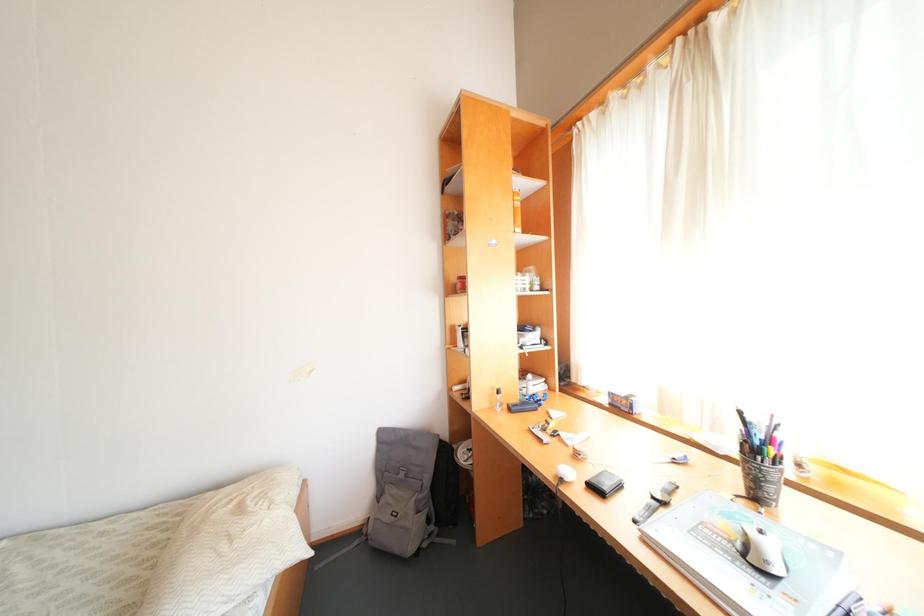
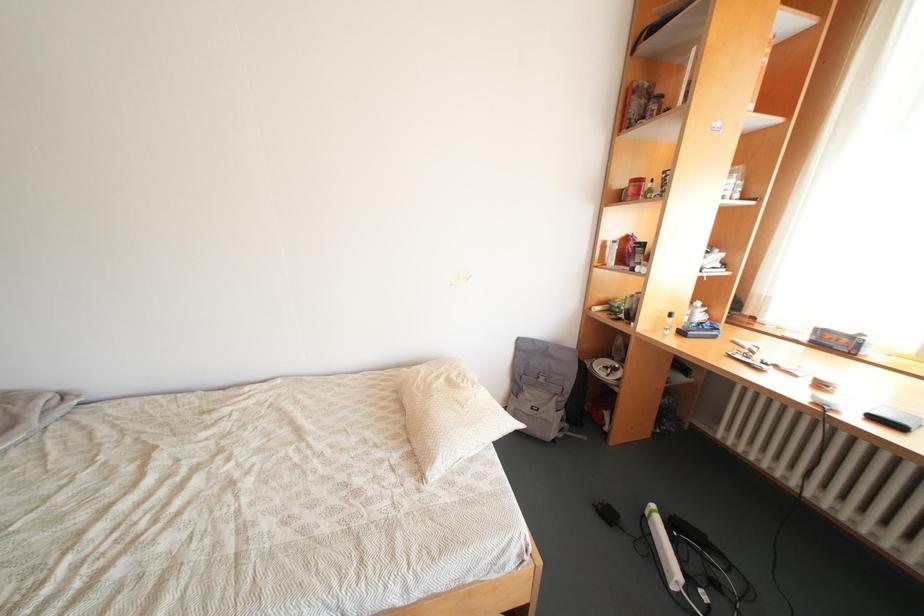
Question: The images are taken continuously from a first-person perspective. In which direction are you moving?

Choices:
 (A) Left
 (B) Right
 (C) Forward
 (D) Backward

Answer: (A)